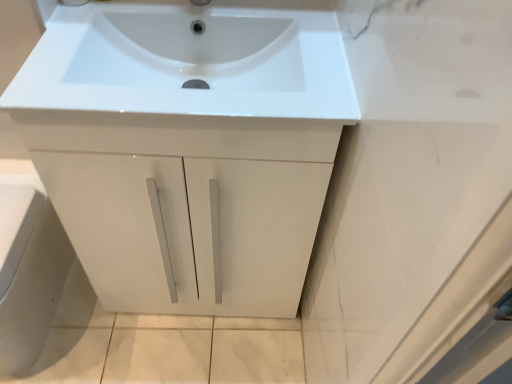
Question: Can white glossy sink at center be found inside white glossy cabinet door at lower left?

Choices:
 (A) no
 (B) yes

Answer: (A)

Question: From a real-world perspective, is white glossy cabinet door at lower left on white glossy sink at center?

Choices:
 (A) no
 (B) yes

Answer: (A)

Question: Considering the relative sizes of white glossy cabinet door at lower left and white glossy sink at center in the image provided, is white glossy cabinet door at lower left taller than white glossy sink at center?

Choices:
 (A) yes
 (B) no

Answer: (A)

Question: From the image's perspective, does white glossy cabinet door at lower left appear higher than white glossy sink at center?

Choices:
 (A) no
 (B) yes

Answer: (A)

Question: Can you confirm if white glossy cabinet door at lower left is thinner than white glossy sink at center?

Choices:
 (A) no
 (B) yes

Answer: (A)

Question: Is white glossy cabinet door at lower left further to camera compared to white glossy sink at center?

Choices:
 (A) no
 (B) yes

Answer: (B)

Question: Is white glossy sink at center completely or partially outside of white glossy cabinet door at lower left?

Choices:
 (A) yes
 (B) no

Answer: (A)

Question: From a real-world perspective, is white glossy sink at center positioned under white glossy cabinet door at lower left based on gravity?

Choices:
 (A) yes
 (B) no

Answer: (B)

Question: Is white glossy sink at center positioned with its back to white glossy cabinet door at lower left?

Choices:
 (A) no
 (B) yes

Answer: (A)

Question: Can you confirm if white glossy sink at center is smaller than white glossy cabinet door at lower left?

Choices:
 (A) no
 (B) yes

Answer: (B)

Question: Considering the relative sizes of white glossy sink at center and white glossy cabinet door at lower left in the image provided, is white glossy sink at center wider than white glossy cabinet door at lower left?

Choices:
 (A) no
 (B) yes

Answer: (A)

Question: Would you say white glossy cabinet door at lower left is part of white glossy sink at center's contents?

Choices:
 (A) yes
 (B) no

Answer: (B)

Question: Is point click(x=88, y=102) closer or farther from the camera than point click(x=31, y=291)?

Choices:
 (A) closer
 (B) farther

Answer: (A)